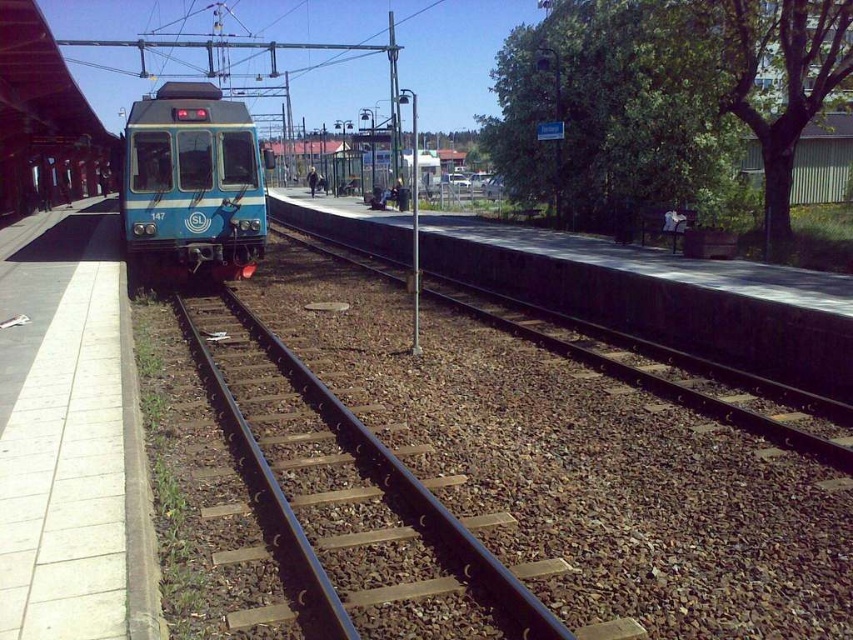
You are a railway inspector checking the alignment of the tracks. You notice the blue glossy train at center is parked over the black metal train track at center. Based on the width comparison between them, could the train be safely positioned on the track without any risk of derailment?

The black metal train track at center has a lesser width compared to the blue glossy train at center. Since the train is wider than the track, there is a risk of derailment if the train is not precisely centered on the track.

You are a maintenance worker needing to cross from the platform to the train track. The platform edge is 1.5 meters away from the black metal track at center. Can you safely step onto the black metal train track at center without overreaching?

The distance between the black metal track at center and the black metal train track at center is 5.18 meters. Since the platform edge is only 1.5 meters from the black metal track at center, the total gap between the platform edge and the black metal train track at center would be 5.18 meters plus 1.5 meters, totaling 6.68 meters. This distance is too wide to safely step across, so you should use a bridge or designated crossing instead.